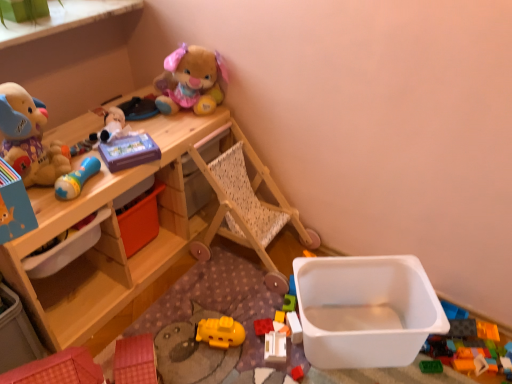
Find the location of `free area below wooden baby carriage at center (from a real-world perspective)`. free area below wooden baby carriage at center (from a real-world perspective) is located at coordinates (243, 263).